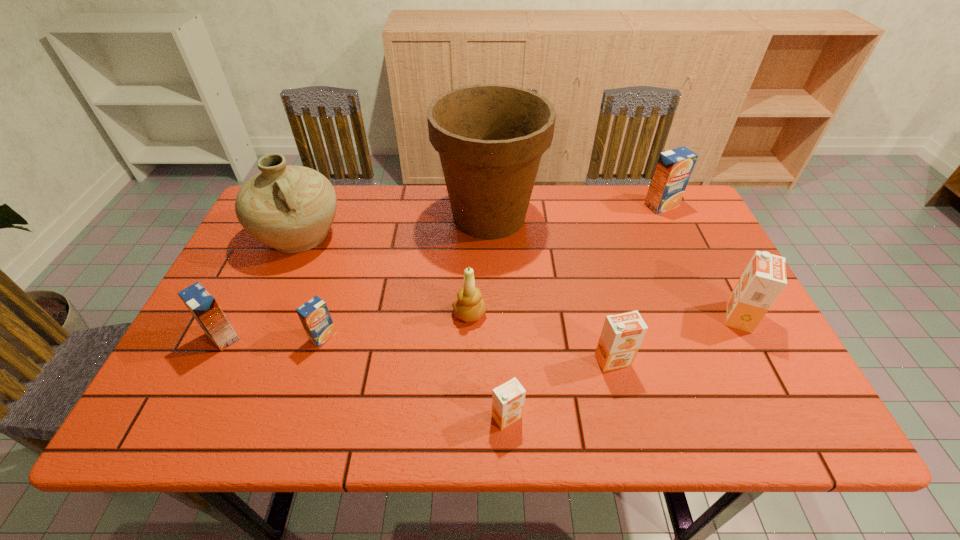
You are a GUI agent. You are given a task and a screenshot of the screen. Output one action in this format:
    pyautogui.click(x=<x>, y=<y>)
    Task: Click on the blank area located 0.220m on the back of the leftmost blue orange_juice
    The width and height of the screenshot is (960, 540).
    Given the screenshot: What is the action you would take?
    pyautogui.click(x=262, y=259)

What are the coordinates of `free space located 0.310m on the left of the seventh object from left to right` in the screenshot? It's located at (455, 360).

The width and height of the screenshot is (960, 540). What are the coordinates of `vacant space located on the left of the smallest blue orange_juice` in the screenshot? It's located at (236, 336).

Find the location of a particular element. vacant area situated 0.380m on the back of the third orange juice from left to right is located at coordinates (500, 272).

Where is `flowerpot that is at the far edge`? This screenshot has height=540, width=960. flowerpot that is at the far edge is located at coordinates (490, 137).

You are a GUI agent. You are given a task and a screenshot of the screen. Output one action in this format:
    pyautogui.click(x=<x>, y=<y>)
    Task: Click on the pottery at the far edge
    The width and height of the screenshot is (960, 540).
    Given the screenshot: What is the action you would take?
    click(x=290, y=208)

The width and height of the screenshot is (960, 540). In order to click on orange_juice that is at the far edge in this screenshot , I will do `click(674, 167)`.

Find the location of a particular element. The height and width of the screenshot is (540, 960). object present at the near edge is located at coordinates (508, 399).

This screenshot has height=540, width=960. Find the location of `pottery that is at the left edge`. pottery that is at the left edge is located at coordinates (x=290, y=208).

The image size is (960, 540). Identify the location of orange_juice at the left edge. (202, 305).